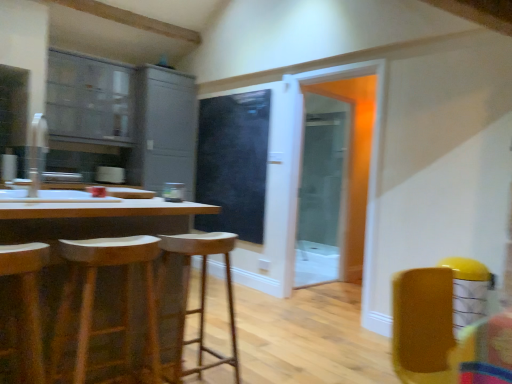
Identify the location of wooden stool at center, arranged as the 1th stool when viewed from the back. The image size is (512, 384). (200, 294).

What is the approximate height of wooden bar stool at left, arranged as the 3th stool when viewed from the back?

It is 24.50 inches.

At what (x,y) coordinates should I click in order to perform the action: click on wooden bar stool at left, arranged as the 3th stool when viewed from the back. Please return your answer as a coordinate pair (x, y). The width and height of the screenshot is (512, 384). Looking at the image, I should click on (26, 304).

In order to face wooden table at left, should I rotate leftwards or rightwards?

Turn left by 21.852 degrees to look at wooden table at left.

Measure the distance between point (116, 128) and camera.

The depth of point (116, 128) is 4.62 meters.

This screenshot has width=512, height=384. Find the location of `white glossy sink at left`. white glossy sink at left is located at coordinates (44, 173).

Is black matte screen door at center, which appears as the 2th screen door when viewed from the right, positioned in front of clear glass screen door at center, placed as the first screen door when sorted from right to left?

That is False.

Which is behind, point (219, 124) or point (347, 145)?

The point (347, 145) is behind.

Can you confirm if black matte screen door at center, which appears as the 2th screen door when viewed from the right, is taller than clear glass screen door at center, the second screen door in the left-to-right sequence?

Incorrect, the height of black matte screen door at center, which appears as the 2th screen door when viewed from the right, is not larger of that of clear glass screen door at center, the second screen door in the left-to-right sequence.

In terms of width, does black matte screen door at center, marked as the 1th screen door in a left-to-right arrangement, look wider or thinner when compared to clear glass screen door at center, placed as the first screen door when sorted from right to left?

In the image, black matte screen door at center, marked as the 1th screen door in a left-to-right arrangement, appears to be more narrow than clear glass screen door at center, placed as the first screen door when sorted from right to left.

From a real-world perspective, is matte gray cabinet at upper left, the 2th cabinetry when ordered from left to right, located higher than matte gray cabinets at upper left, which appears as the 1th cabinetry when viewed from the left?

No, from a real-world perspective, matte gray cabinet at upper left, the 2th cabinetry when ordered from left to right, is not above matte gray cabinets at upper left, which appears as the 1th cabinetry when viewed from the left.

Are matte gray cabinet at upper left, which is the 1th cabinetry from right to left, and matte gray cabinets at upper left, which appears as the 1th cabinetry when viewed from the left, located far from each other?

No, matte gray cabinet at upper left, which is the 1th cabinetry from right to left, is not far away from matte gray cabinets at upper left, which appears as the 1th cabinetry when viewed from the left.

Which object is further away from the camera taking this photo, matte gray cabinet at upper left, which is the 1th cabinetry from right to left, or matte gray cabinets at upper left, which is the 2th cabinetry in right-to-left order?

matte gray cabinet at upper left, which is the 1th cabinetry from right to left, is further from the camera.

Is matte gray cabinet at upper left, the 2th cabinetry when ordered from left to right, facing away from matte gray cabinets at upper left, which appears as the 1th cabinetry when viewed from the left?

matte gray cabinet at upper left, the 2th cabinetry when ordered from left to right, is not turned away from matte gray cabinets at upper left, which appears as the 1th cabinetry when viewed from the left.

From the image's perspective, which is below, white glossy sink at left or wooden stool at center, arranged as the 1th stool when viewed from the back?

From the image's view, wooden stool at center, arranged as the 1th stool when viewed from the back, is below.

Can you confirm if white glossy sink at left is positioned to the right of wooden stool at center, arranged as the 1th stool when viewed from the back?

In fact, white glossy sink at left is to the left of wooden stool at center, arranged as the 1th stool when viewed from the back.

Could you tell me if white glossy sink at left is facing wooden stool at center, which appears as the third stool when viewed from the front?

No, white glossy sink at left does not turn towards wooden stool at center, which appears as the third stool when viewed from the front.

Looking at this image, are white glossy sink at left and wooden stool at center, arranged as the 1th stool when viewed from the back, beside each other?

white glossy sink at left and wooden stool at center, arranged as the 1th stool when viewed from the back, are clearly separated.

Could you measure the distance between wooden bar stool at left, arranged as the 3th stool when viewed from the back, and matte gray cabinet at upper left, the 2th cabinetry when ordered from left to right?

The distance of wooden bar stool at left, arranged as the 3th stool when viewed from the back, from matte gray cabinet at upper left, the 2th cabinetry when ordered from left to right, is 3.12 meters.

Which object is positioned more to the right, wooden bar stool at left, positioned as the 1th stool in front-to-back order, or matte gray cabinet at upper left, the 2th cabinetry when ordered from left to right?

From the viewer's perspective, wooden bar stool at left, positioned as the 1th stool in front-to-back order, appears more on the right side.

Does wooden bar stool at left, positioned as the 1th stool in front-to-back order, have a greater width compared to matte gray cabinet at upper left, which is the 1th cabinetry from right to left?

Incorrect, the width of wooden bar stool at left, positioned as the 1th stool in front-to-back order, does not surpass that of matte gray cabinet at upper left, which is the 1th cabinetry from right to left.

Is point (122, 75) closer to viewer compared to point (344, 171)?

That is True.

Does matte gray cabinets at upper left, which is the 2th cabinetry in right-to-left order, have a smaller size compared to clear glass screen door at center, the second screen door in the left-to-right sequence?

Incorrect, matte gray cabinets at upper left, which is the 2th cabinetry in right-to-left order, is not smaller in size than clear glass screen door at center, the second screen door in the left-to-right sequence.

Do you think matte gray cabinets at upper left, which is the 2th cabinetry in right-to-left order, is within clear glass screen door at center, the second screen door in the left-to-right sequence, or outside of it?

matte gray cabinets at upper left, which is the 2th cabinetry in right-to-left order, lies outside clear glass screen door at center, the second screen door in the left-to-right sequence.

Which point is more forward, (x=94, y=251) or (x=202, y=338)?

The point (x=94, y=251) is more forward.

Measure the distance from wooden stool at left, the 2th stool when ordered from front to back, to wooden stool at center, which appears as the third stool when viewed from the front.

wooden stool at left, the 2th stool when ordered from front to back, and wooden stool at center, which appears as the third stool when viewed from the front, are 11.99 inches apart from each other.

From the image's perspective, does wooden stool at left, arranged as the second stool when viewed from the back, appear lower than wooden stool at center, which appears as the third stool when viewed from the front?

No, from the image's perspective, wooden stool at left, arranged as the second stool when viewed from the back, is not below wooden stool at center, which appears as the third stool when viewed from the front.

Considering the relative sizes of wooden stool at left, arranged as the second stool when viewed from the back, and wooden stool at center, which appears as the third stool when viewed from the front, in the image provided, is wooden stool at left, arranged as the second stool when viewed from the back, smaller than wooden stool at center, which appears as the third stool when viewed from the front,?

Yes, wooden stool at left, arranged as the second stool when viewed from the back, is smaller than wooden stool at center, which appears as the third stool when viewed from the front.

Is matte gray cabinet at upper left, which is the 1th cabinetry from right to left, next to white glossy sink at left?

They are not placed beside each other.

Between point (154, 173) and point (86, 200), which one is positioned behind?

Point (154, 173)

Which of these two, matte gray cabinet at upper left, which is the 1th cabinetry from right to left, or white glossy sink at left, is wider?

matte gray cabinet at upper left, which is the 1th cabinetry from right to left.

Is matte gray cabinet at upper left, the 2th cabinetry when ordered from left to right, facing away from white glossy sink at left?

No, matte gray cabinet at upper left, the 2th cabinetry when ordered from left to right, is not facing the opposite direction of white glossy sink at left.

Identify the location of screen door on the left of clear glass screen door at center, the second screen door in the left-to-right sequence. (233, 163).

Locate an element on the screen. The image size is (512, 384). cabinetry above the matte gray cabinet at upper left, the 2th cabinetry when ordered from left to right (from a real-world perspective) is located at coordinates (89, 98).

Estimate the real-world distances between objects in this image. Which object is further from clear glass screen door at center, placed as the first screen door when sorted from right to left, matte gray cabinet at upper left, the 2th cabinetry when ordered from left to right, or black matte screen door at center, marked as the 1th screen door in a left-to-right arrangement?

matte gray cabinet at upper left, the 2th cabinetry when ordered from left to right, is further to clear glass screen door at center, placed as the first screen door when sorted from right to left.

Looking at the image, which one is located further to wooden table at left, clear glass screen door at center, placed as the first screen door when sorted from right to left, or white glossy sink at left?

clear glass screen door at center, placed as the first screen door when sorted from right to left, lies further to wooden table at left than the other object.

Which object lies nearer to the anchor point wooden stool at left, arranged as the second stool when viewed from the back, wooden table at left or matte gray cabinet at upper left, which is the 1th cabinetry from right to left?

wooden table at left is positioned closer to the anchor wooden stool at left, arranged as the second stool when viewed from the back.

Consider the image. Estimate the real-world distances between objects in this image. Which object is further from clear glass screen door at center, placed as the first screen door when sorted from right to left, wooden stool at center, which appears as the third stool when viewed from the front, or matte gray cabinet at upper left, the 2th cabinetry when ordered from left to right?

Among the two, wooden stool at center, which appears as the third stool when viewed from the front, is located further to clear glass screen door at center, placed as the first screen door when sorted from right to left.

From the image, which object appears to be farther from matte gray cabinets at upper left, which appears as the 1th cabinetry when viewed from the left, wooden stool at center, arranged as the 1th stool when viewed from the back, or wooden stool at left, the 2th stool when ordered from front to back?

Among the two, wooden stool at left, the 2th stool when ordered from front to back, is located further to matte gray cabinets at upper left, which appears as the 1th cabinetry when viewed from the left.

Based on their spatial positions, is clear glass screen door at center, placed as the first screen door when sorted from right to left, or wooden stool at center, which appears as the third stool when viewed from the front, closer to matte gray cabinet at upper left, which is the 1th cabinetry from right to left?

Based on the image, clear glass screen door at center, placed as the first screen door when sorted from right to left, appears to be nearer to matte gray cabinet at upper left, which is the 1th cabinetry from right to left.

Based on their spatial positions, is wooden stool at center, which appears as the third stool when viewed from the front, or clear glass screen door at center, placed as the first screen door when sorted from right to left, closer to wooden stool at left, the 2th stool when ordered from front to back?

Among the two, wooden stool at center, which appears as the third stool when viewed from the front, is located nearer to wooden stool at left, the 2th stool when ordered from front to back.

From the picture: From the image, which object appears to be nearer to wooden bar stool at left, positioned as the 1th stool in front-to-back order, matte gray cabinets at upper left, which is the 2th cabinetry in right-to-left order, or wooden stool at left, the 2th stool when ordered from front to back?

Based on the image, wooden stool at left, the 2th stool when ordered from front to back, appears to be nearer to wooden bar stool at left, positioned as the 1th stool in front-to-back order.

This screenshot has height=384, width=512. I want to click on sink positioned between wooden stool at center, which appears as the third stool when viewed from the front, and matte gray cabinets at upper left, which is the 2th cabinetry in right-to-left order, from near to far, so click(44, 173).

Locate an element on the screen. The width and height of the screenshot is (512, 384). stool between white glossy sink at left and wooden stool at left, arranged as the second stool when viewed from the back, from top to bottom is located at coordinates pyautogui.click(x=26, y=304).

Locate an element on the screen. sink between wooden bar stool at left, arranged as the 3th stool when viewed from the back, and matte gray cabinet at upper left, the 2th cabinetry when ordered from left to right, in the front-back direction is located at coordinates (44, 173).

Locate an element on the screen. The height and width of the screenshot is (384, 512). sink between wooden table at left and black matte screen door at center, marked as the 1th screen door in a left-to-right arrangement, from front to back is located at coordinates (44, 173).